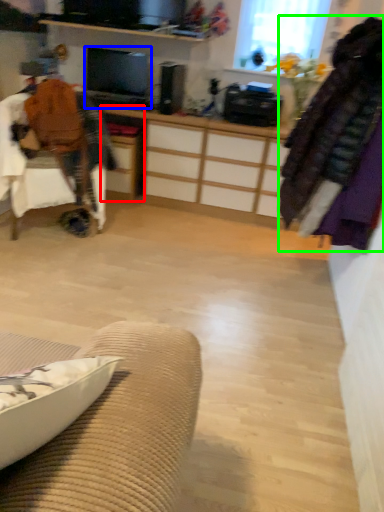
Question: Which is farther away from desk (highlighted by a red box)? television (highlighted by a blue box) or clothing (highlighted by a green box)?

Choices:
 (A) television
 (B) clothing

Answer: (B)